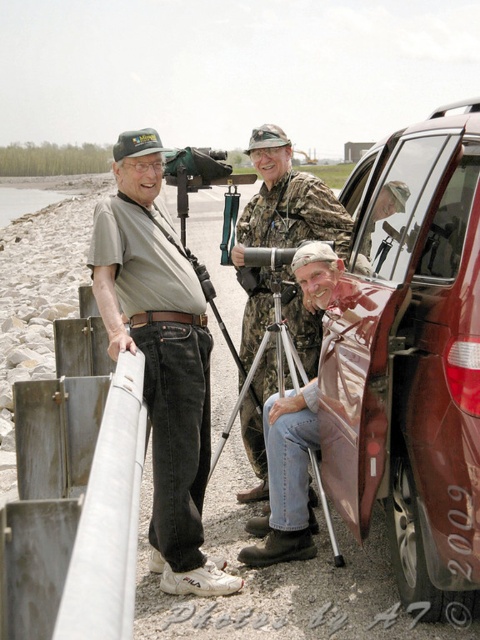
Question: Does shiny metallic car door at right appear on the left side of silver metallic tripod at center?

Choices:
 (A) yes
 (B) no

Answer: (B)

Question: Is matte gray shirt at left above silver metallic tripod at center?

Choices:
 (A) no
 (B) yes

Answer: (B)

Question: Which point appears closest to the camera in this image?

Choices:
 (A) (127, 236)
 (B) (448, 428)
 (C) (210, 472)

Answer: (B)

Question: Is shiny metallic car door at right above camouflage fabric uniform at center?

Choices:
 (A) yes
 (B) no

Answer: (A)

Question: Which object appears farthest from the camera in this image?

Choices:
 (A) shiny metallic car door at right
 (B) silver metallic tripod at center

Answer: (B)

Question: Which of the following is the farthest from the observer?

Choices:
 (A) (200, 474)
 (B) (278, 129)

Answer: (B)